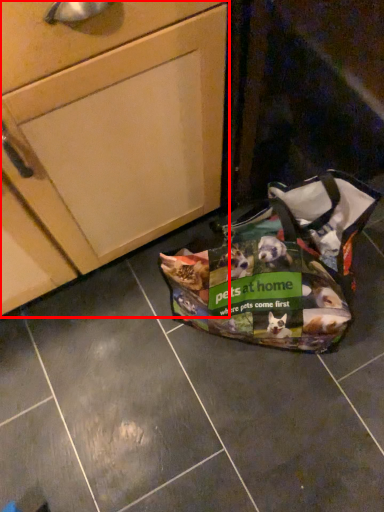
Question: From the image's perspective, what is the correct spatial relationship of cabinetry (annotated by the red box) in relation to handbag?

Choices:
 (A) above
 (B) below

Answer: (A)